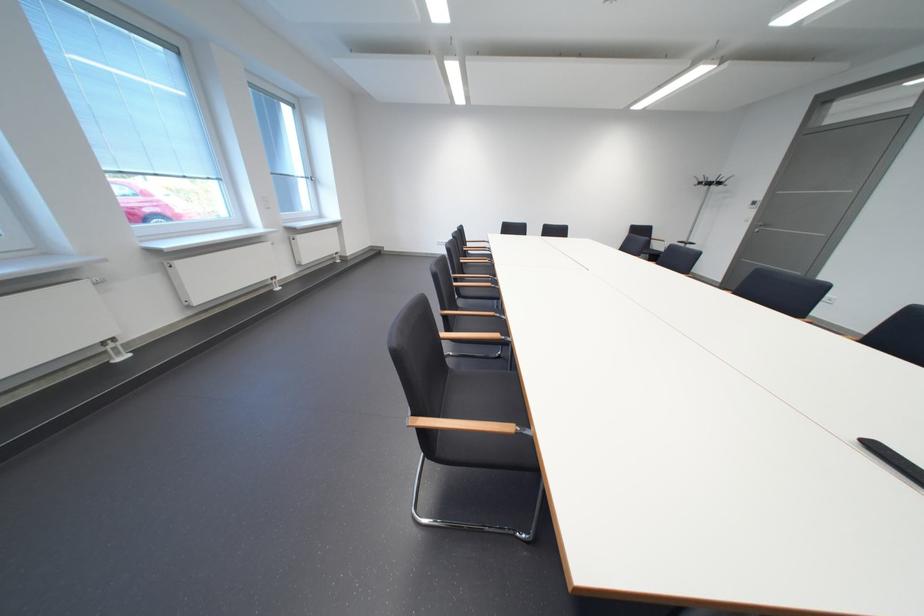
Find where to pull the silver door handle. Please return your answer as a coordinate pair (x, y).

(759, 227)